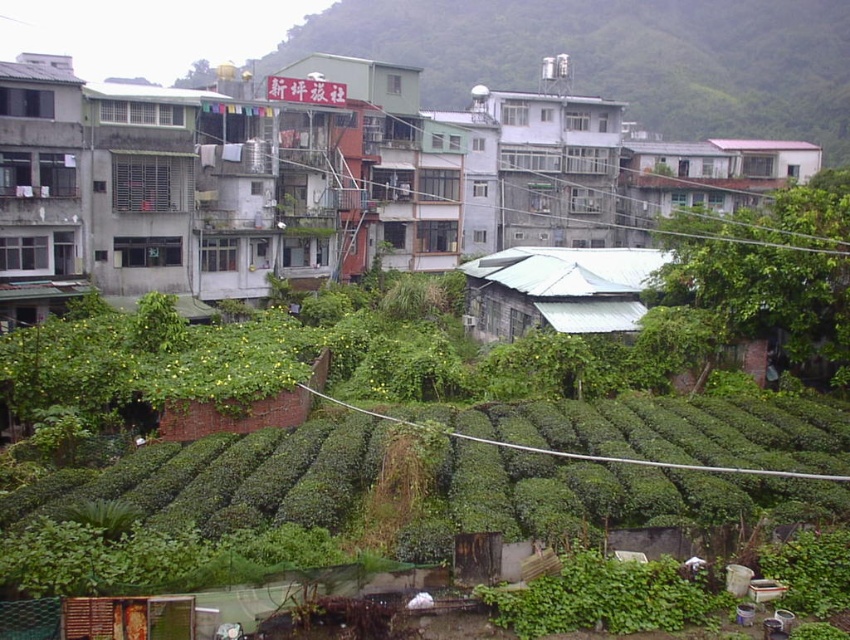
Question: In this image, where is green leafy hedge at lower center located relative to green matte building at upper center?

Choices:
 (A) left
 (B) right

Answer: (A)

Question: Among these objects, which one is nearest to the camera?

Choices:
 (A) gray concrete building at center
 (B) green matte building at upper center

Answer: (A)

Question: Does green matte building at upper center appear over gray concrete building at center?

Choices:
 (A) yes
 (B) no

Answer: (A)

Question: Which is nearer to the green matte building at upper center?

Choices:
 (A) green leafy hedge at lower center
 (B) gray concrete building at center

Answer: (B)

Question: Which object is the farthest from the gray concrete building at center?

Choices:
 (A) green leafy hedge at lower center
 (B) green matte building at upper center

Answer: (B)

Question: Where is green leafy hedge at lower center located in relation to green matte building at upper center in the image?

Choices:
 (A) above
 (B) below

Answer: (B)